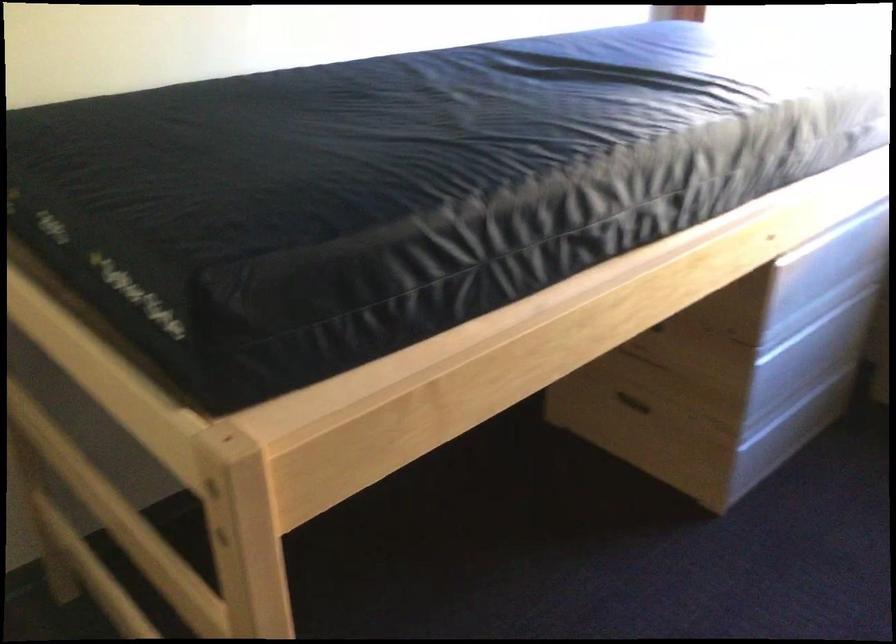
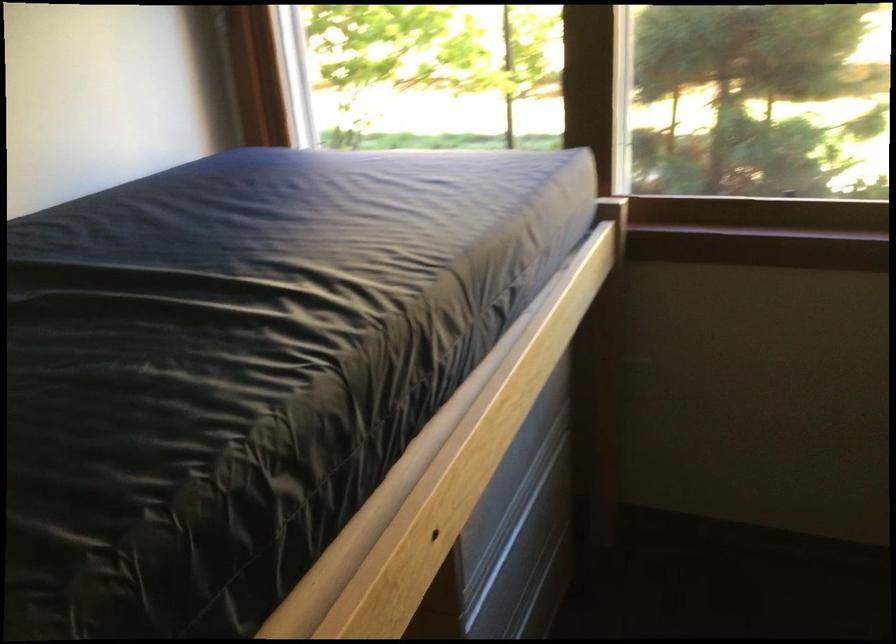
In the second image, find the point that corresponds to pixel 793 220 in the first image.

(467, 478)